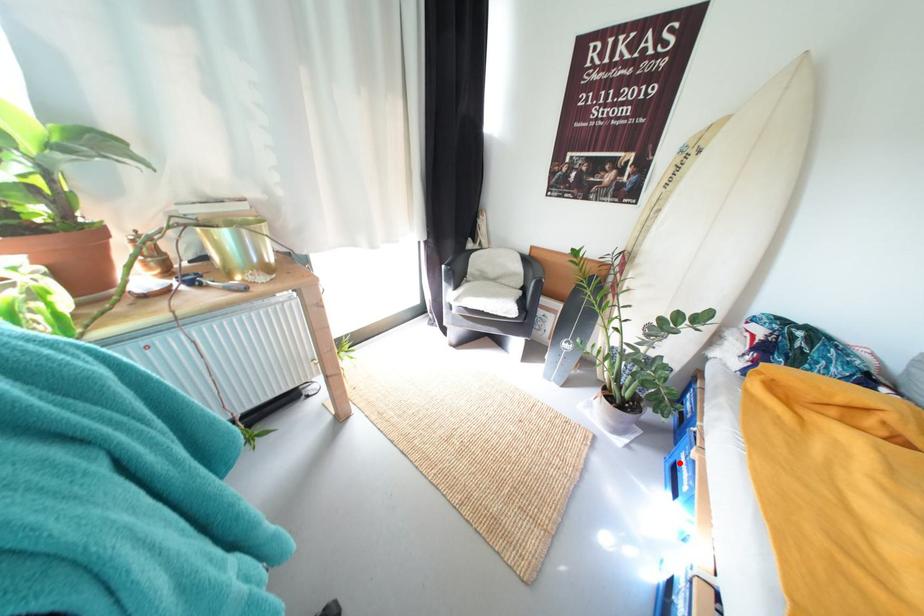
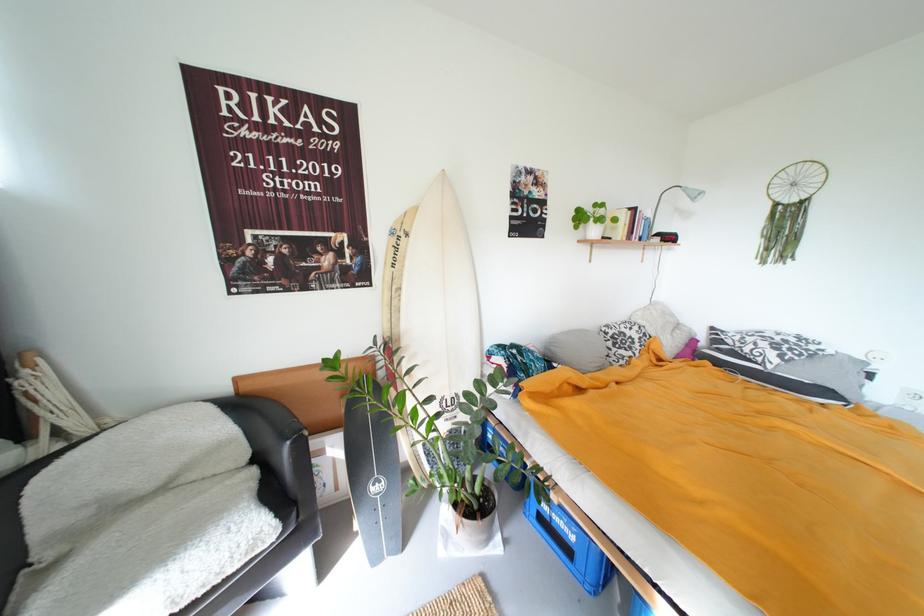
Locate, in the second image, the point that corresponds to the highlighted location in the first image.

(542, 517)